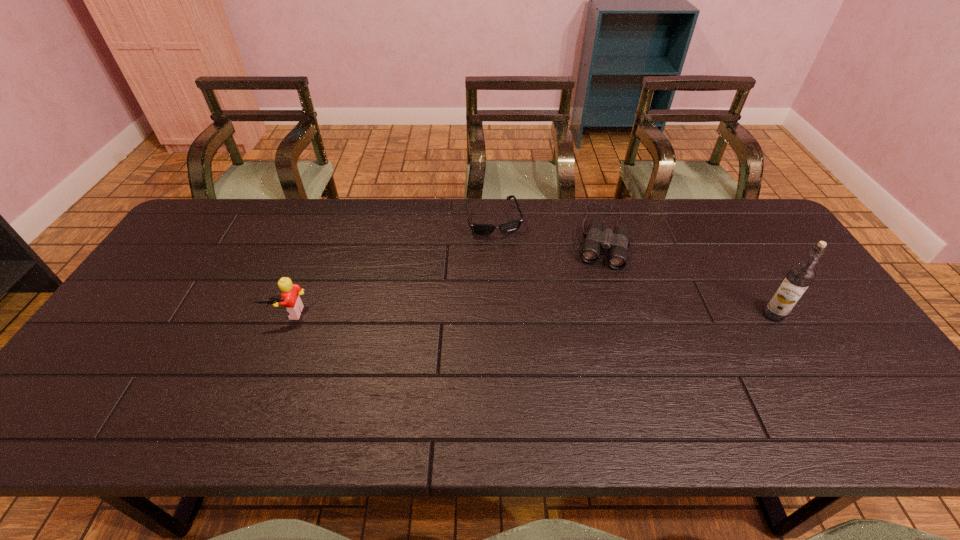
What are the coordinates of `vacant space located 0.320m on the front-facing side of the sunglasses` in the screenshot? It's located at (521, 314).

The height and width of the screenshot is (540, 960). In order to click on free space located on the front-facing side of the sunglasses in this screenshot , I will do `click(524, 326)`.

Where is `vacant position located 0.400m on the front-facing side of the sunglasses`? This screenshot has height=540, width=960. vacant position located 0.400m on the front-facing side of the sunglasses is located at coordinates (528, 339).

Find the location of a particular element. Image resolution: width=960 pixels, height=540 pixels. vacant space located 0.250m at the eyepiece of the binoculars is located at coordinates (590, 335).

Locate an element on the screen. vacant position located 0.370m at the eyepiece of the binoculars is located at coordinates (584, 374).

Locate an element on the screen. This screenshot has width=960, height=540. free location located at the eyepiece of the binoculars is located at coordinates (596, 305).

Where is `sunglasses situated at the far edge`? sunglasses situated at the far edge is located at coordinates (479, 229).

At what (x,y) coordinates should I click in order to perform the action: click on binoculars present at the far edge. Please return your answer as a coordinate pair (x, y). Looking at the image, I should click on (617, 243).

You are a GUI agent. You are given a task and a screenshot of the screen. Output one action in this format:
    pyautogui.click(x=<x>, y=<y>)
    Task: Click on the object situated at the right edge
    This screenshot has height=540, width=960.
    Given the screenshot: What is the action you would take?
    pyautogui.click(x=798, y=278)

Where is `free region at the far edge of the desktop`? The height and width of the screenshot is (540, 960). free region at the far edge of the desktop is located at coordinates (361, 220).